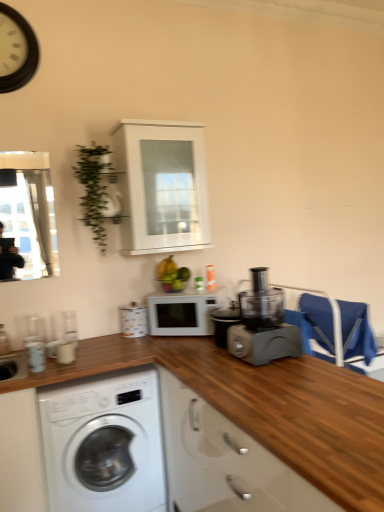
Question: Is the depth of white wooden clock at upper left greater than that of green leafy plant at upper left?

Choices:
 (A) no
 (B) yes

Answer: (A)

Question: Can you confirm if white wooden clock at upper left is smaller than green leafy plant at upper left?

Choices:
 (A) yes
 (B) no

Answer: (A)

Question: Considering the relative positions of white wooden clock at upper left and green leafy plant at upper left in the image provided, is white wooden clock at upper left to the right of green leafy plant at upper left from the viewer's perspective?

Choices:
 (A) no
 (B) yes

Answer: (A)

Question: Can you confirm if white wooden clock at upper left is shorter than green leafy plant at upper left?

Choices:
 (A) yes
 (B) no

Answer: (A)

Question: Is white wooden clock at upper left placed right next to green leafy plant at upper left?

Choices:
 (A) yes
 (B) no

Answer: (B)

Question: Could green leafy plant at upper left be considered to be inside white wooden clock at upper left?

Choices:
 (A) no
 (B) yes

Answer: (A)

Question: From a real-world perspective, is blue fabric chair at right physically above green matte bananas at center?

Choices:
 (A) no
 (B) yes

Answer: (A)

Question: Considering the relative sizes of blue fabric chair at right and green matte bananas at center in the image provided, is blue fabric chair at right taller than green matte bananas at center?

Choices:
 (A) no
 (B) yes

Answer: (B)

Question: Does blue fabric chair at right appear on the right side of green matte bananas at center?

Choices:
 (A) no
 (B) yes

Answer: (B)

Question: Does blue fabric chair at right turn towards green matte bananas at center?

Choices:
 (A) yes
 (B) no

Answer: (B)

Question: Is blue fabric chair at right to the left of green matte bananas at center from the viewer's perspective?

Choices:
 (A) no
 (B) yes

Answer: (A)

Question: Does blue fabric chair at right have a lesser height compared to green matte bananas at center?

Choices:
 (A) yes
 (B) no

Answer: (B)

Question: Considering the relative sizes of blue fabric chair at right and white glossy canister at upper center, the 2th appliance when ordered from front to back, in the image provided, is blue fabric chair at right smaller than white glossy canister at upper center, the 2th appliance when ordered from front to back,?

Choices:
 (A) no
 (B) yes

Answer: (A)